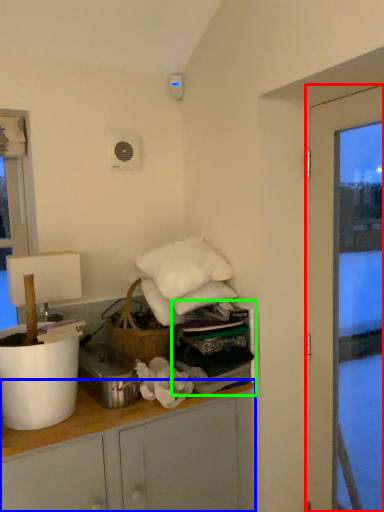
Question: Which object is the closest to the door (highlighted by a red box)? Choose among these: cabinetry (highlighted by a blue box) or shelf (highlighted by a green box).

Choices:
 (A) cabinetry
 (B) shelf

Answer: (B)